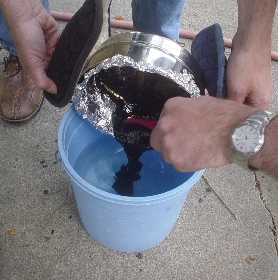
This screenshot has height=280, width=278. What are the coordinates of `bowl` in the screenshot? It's located at (139, 53).